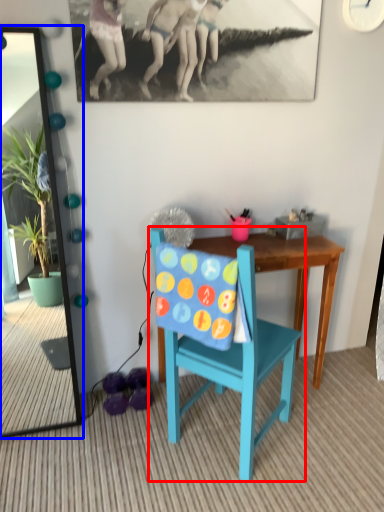
Question: Among these objects, which one is farthest to the camera, chair (highlighted by a red box) or mirror (highlighted by a blue box)?

Choices:
 (A) chair
 (B) mirror

Answer: (B)